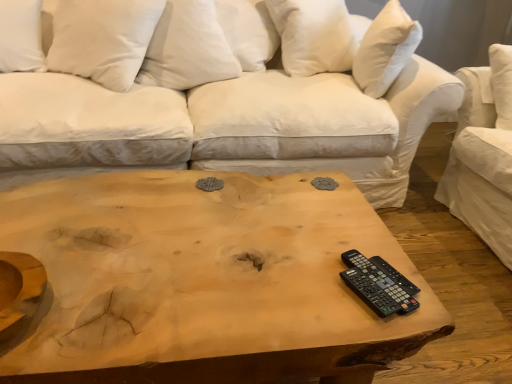
Question: Is white cotton pillow at upper center, the third pillow from the left, wider than white cotton studio couch at center?

Choices:
 (A) yes
 (B) no

Answer: (B)

Question: Is the position of white cotton pillow at upper center, marked as the second pillow in a right-to-left arrangement, more distant than that of white cotton studio couch at center?

Choices:
 (A) yes
 (B) no

Answer: (A)

Question: Can you confirm if white cotton pillow at upper center, the third pillow from the left, is smaller than white cotton studio couch at center?

Choices:
 (A) no
 (B) yes

Answer: (B)

Question: Would you say white cotton studio couch at center is part of white cotton pillow at upper center, marked as the second pillow in a right-to-left arrangement,'s contents?

Choices:
 (A) no
 (B) yes

Answer: (A)

Question: From the image's perspective, is white cotton pillow at upper center, marked as the second pillow in a right-to-left arrangement, over white cotton studio couch at center?

Choices:
 (A) yes
 (B) no

Answer: (A)

Question: From their relative heights in the image, would you say black plastic remote at lower right is taller or shorter than natural wood coffee table at center?

Choices:
 (A) short
 (B) tall

Answer: (A)

Question: Is black plastic remote at lower right bigger or smaller than natural wood coffee table at center?

Choices:
 (A) big
 (B) small

Answer: (B)

Question: From a real-world perspective, is black plastic remote at lower right physically located above or below natural wood coffee table at center?

Choices:
 (A) below
 (B) above

Answer: (B)

Question: In the image, is black plastic remote at lower right positioned in front of or behind natural wood coffee table at center?

Choices:
 (A) front
 (B) behind

Answer: (B)

Question: Considering the positions of white soft pillow at upper left, the third pillow in the right-to-left sequence, and white soft pillow at upper left, arranged as the fourth pillow when viewed from the right, in the image, is white soft pillow at upper left, the third pillow in the right-to-left sequence, wider or thinner than white soft pillow at upper left, arranged as the fourth pillow when viewed from the right,?

Choices:
 (A) wide
 (B) thin

Answer: (A)

Question: From a real-world perspective, is white soft pillow at upper left, the third pillow in the right-to-left sequence, positioned above or below white soft pillow at upper left, the 1th pillow positioned from the left?

Choices:
 (A) below
 (B) above

Answer: (B)

Question: From the image's perspective, is white soft pillow at upper left, the third pillow in the right-to-left sequence, above or below white soft pillow at upper left, arranged as the fourth pillow when viewed from the right?

Choices:
 (A) below
 (B) above

Answer: (A)

Question: Choose the correct answer: Is white soft pillow at upper left, the third pillow in the right-to-left sequence, inside white soft pillow at upper left, the 1th pillow positioned from the left, or outside it?

Choices:
 (A) outside
 (B) inside

Answer: (A)

Question: Is white cotton studio couch at center to the left or to the right of natural wood coffee table at center in the image?

Choices:
 (A) right
 (B) left

Answer: (B)

Question: From a real-world perspective, is white cotton studio couch at center above or below natural wood coffee table at center?

Choices:
 (A) above
 (B) below

Answer: (A)